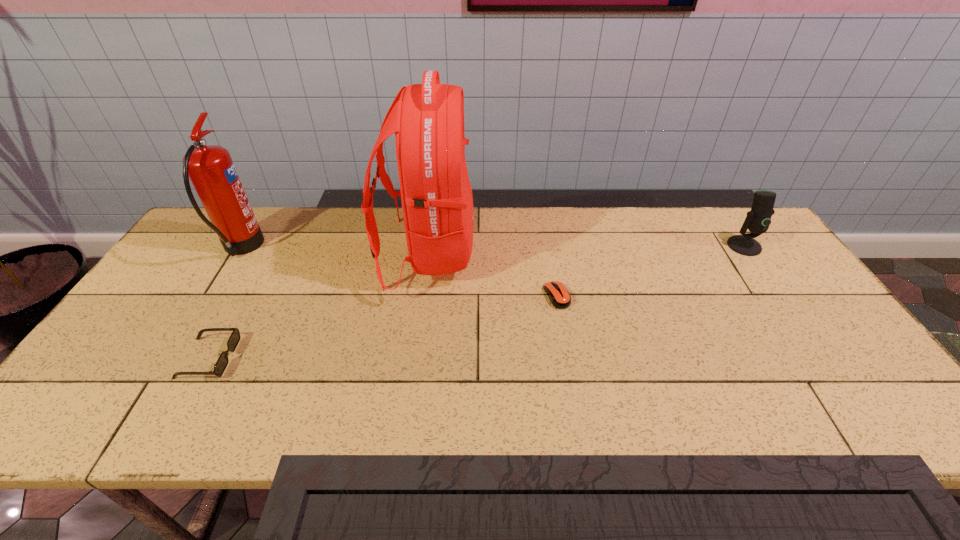
Locate an element on the screen. Image resolution: width=960 pixels, height=540 pixels. vacant region between the fourth shortest object and the fourth object from left to right is located at coordinates (398, 272).

You are a GUI agent. You are given a task and a screenshot of the screen. Output one action in this format:
    pyautogui.click(x=<x>, y=<y>)
    Task: Click on the empty location between the rightmost object and the shortest object
    This screenshot has width=960, height=540.
    Given the screenshot: What is the action you would take?
    pyautogui.click(x=650, y=271)

At what (x,y) coordinates should I click in order to perform the action: click on free spot between the sunglasses and the third tallest object. Please return your answer as a coordinate pair (x, y). Looking at the image, I should click on (476, 302).

Where is `vacant space that's between the third object from right to left and the computer mouse`? Image resolution: width=960 pixels, height=540 pixels. vacant space that's between the third object from right to left and the computer mouse is located at coordinates (492, 274).

You are a GUI agent. You are given a task and a screenshot of the screen. Output one action in this format:
    pyautogui.click(x=<x>, y=<y>)
    Task: Click on the unoccupied area between the backpack and the computer mouse
    This screenshot has height=540, width=960.
    Given the screenshot: What is the action you would take?
    pyautogui.click(x=492, y=274)

You are a GUI agent. You are given a task and a screenshot of the screen. Output one action in this format:
    pyautogui.click(x=<x>, y=<y>)
    Task: Click on the free space between the fire extinguisher and the fourth tallest object
    The width and height of the screenshot is (960, 540).
    Given the screenshot: What is the action you would take?
    pyautogui.click(x=225, y=303)

Locate which object is the closest to the shortest object. Please provide its 2D coordinates. Your answer should be formatted as a tuple, i.e. [(x, y)], where the tuple contains the x and y coordinates of a point satisfying the conditions above.

[(428, 119)]

Select which object is the fourth closest to the backpack. Please provide its 2D coordinates. Your answer should be formatted as a tuple, i.e. [(x, y)], where the tuple contains the x and y coordinates of a point satisfying the conditions above.

[(757, 221)]

This screenshot has height=540, width=960. I want to click on vacant area in the image that satisfies the following two spatial constraints: 1. on the front side of the microphone; 2. on the main compartment of the tallest object, so coord(749,252).

Identify the location of vacant area in the image that satisfies the following two spatial constraints: 1. on the main compartment of the third object from right to left; 2. on the right side of the computer mouse. (423, 296).